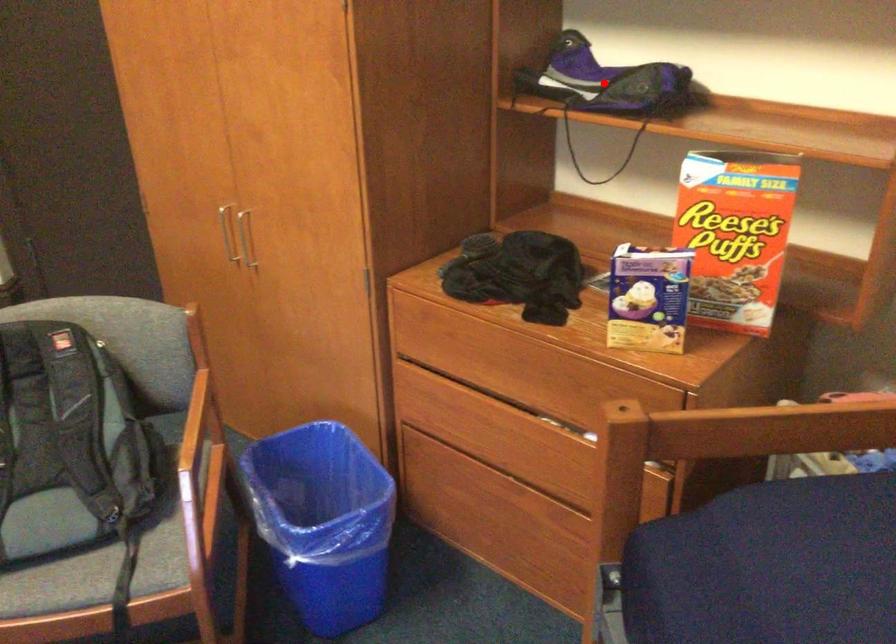
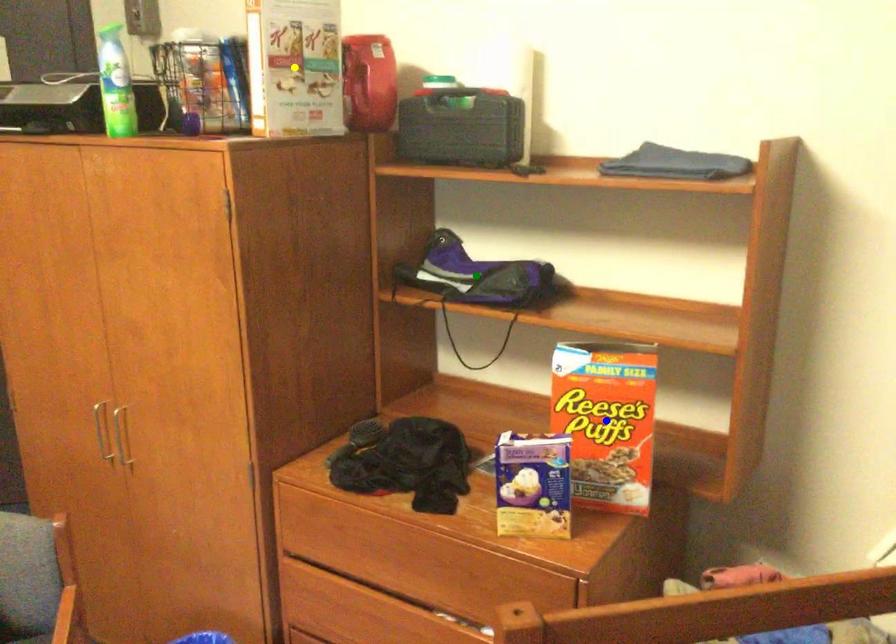
Question: I am providing you with two images of the same scene from different viewpoints. A red point is marked on the first image. You are given multiple points on the second image. Which point in image 2 is actually the same real-world point as the red point in image 1?

Choices:
 (A) green point
 (B) blue point
 (C) yellow point

Answer: (A)